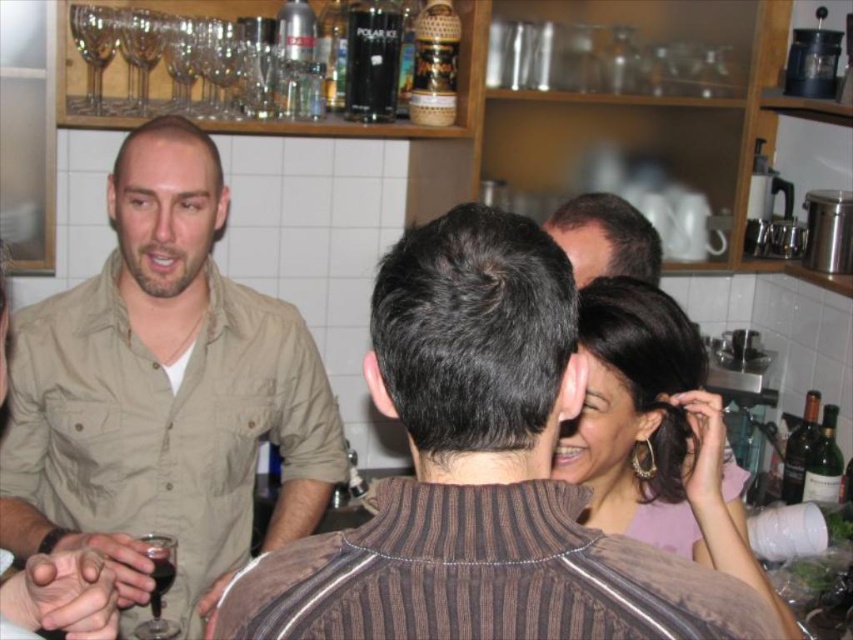
You are a bartender preparing drinks for guests. You notice the brown textured shirt at center and the black plastic cup at upper center. Which object is bigger in size?

The brown textured shirt at center is larger in size compared to the black plastic cup at upper center.

You are a photographer taking a photo of the scene described. The gold hoop earrings at upper right are important to capture clearly. Based on their position at point (656, 435), where should you focus your camera to ensure they are in sharp focus?

You should focus your camera at point (656, 435) to ensure the gold hoop earrings at upper right are in sharp focus.

You are at a social event and want to take a photo of the gold hoop earrings at upper right. Where should you position your camera to capture them?

To capture the gold hoop earrings at upper right, position your camera near the coordinates point (x=656, y=435).